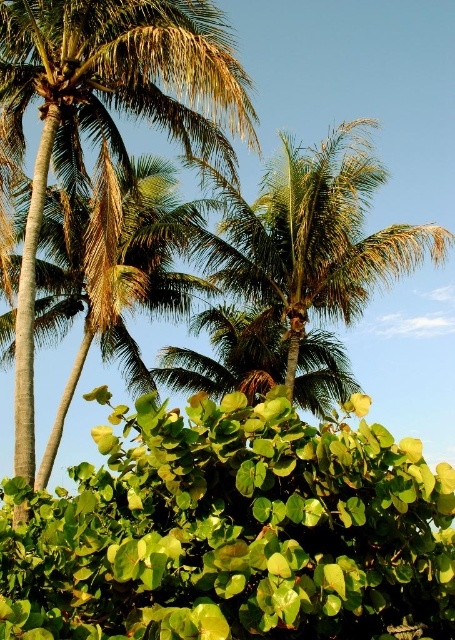
Question: Does green leafy palm at center have a smaller size compared to green leafy palm tree at center?

Choices:
 (A) no
 (B) yes

Answer: (A)

Question: Which point is closer to the camera taking this photo?

Choices:
 (A) (364, 140)
 (B) (134, 189)

Answer: (A)

Question: Which of the following is the closest to the observer?

Choices:
 (A) green leafy palm at center
 (B) green leafy palm tree at center

Answer: (B)

Question: Can you confirm if green leafy palm at center is positioned below green leafy palm tree at center?

Choices:
 (A) no
 (B) yes

Answer: (A)

Question: Is green leafy palm at center below green leafy palm tree at center?

Choices:
 (A) no
 (B) yes

Answer: (A)

Question: Which of the following is the closest to the observer?

Choices:
 (A) (237, 252)
 (B) (134, 188)

Answer: (A)